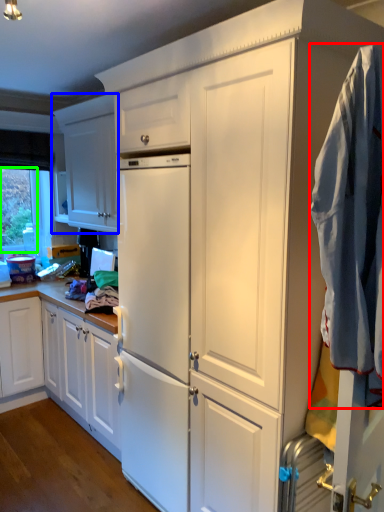
Question: Which object is positioned farthest from clothing (highlighted by a red box)? Select from cabinetry (highlighted by a blue box) and window screen (highlighted by a green box).

Choices:
 (A) cabinetry
 (B) window screen

Answer: (B)